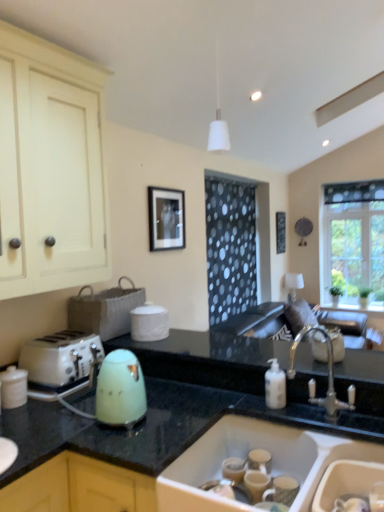
What do you see at coordinates (13, 387) in the screenshot? I see `white glossy jar at lower left` at bounding box center [13, 387].

What do you see at coordinates (60, 358) in the screenshot?
I see `white plastic toaster at left` at bounding box center [60, 358].

Where is `white glossy jar at lower left`? This screenshot has width=384, height=512. white glossy jar at lower left is located at coordinates (13, 387).

Considering the sizes of objects white glossy jar at lower left and white plastic toaster at left in the image provided, who is shorter, white glossy jar at lower left or white plastic toaster at left?

Standing shorter between the two is white glossy jar at lower left.

From the image's perspective, is white glossy jar at lower left above or below white plastic toaster at left?

white glossy jar at lower left is below white plastic toaster at left.

Locate an element on the screen. kitchen appliance on the left of white plastic toaster at left is located at coordinates (13, 387).

Between white glossy jar at lower left and white plastic toaster at left, which one has larger size?

Bigger between the two is white plastic toaster at left.

From their relative heights in the image, would you say matte cream cabinet at left is taller or shorter than white plastic toaster at left?

matte cream cabinet at left is taller than white plastic toaster at left.

Considering the positions of objects matte cream cabinet at left and white plastic toaster at left in the image provided, who is more to the left, matte cream cabinet at left or white plastic toaster at left?

From the viewer's perspective, matte cream cabinet at left appears more on the left side.

Is matte cream cabinet at left far away from white plastic toaster at left?

No.

Based on the photo, relative to white plastic toaster at left, is matte cream cabinet at left in front or behind?

matte cream cabinet at left is positioned closer to the viewer than white plastic toaster at left.

Is white ceramic sink at lower center outside of matte cream cabinet at left?

Absolutely, white ceramic sink at lower center is external to matte cream cabinet at left.

From a real-world perspective, which object rests below the other?

white ceramic sink at lower center.

The width and height of the screenshot is (384, 512). In order to click on sink on the right of matte cream cabinet at left in this screenshot , I will do `click(245, 456)`.

Is black matte picture frame at upper center in contact with white ceramic sink at lower center?

No, black matte picture frame at upper center is not with white ceramic sink at lower center.

From the image's perspective, between black matte picture frame at upper center and white ceramic sink at lower center, which one is located above?

black matte picture frame at upper center, from the image's perspective.

Is black matte picture frame at upper center looking in the opposite direction of white ceramic sink at lower center?

No.

Which is more to the right, black matte picture frame at upper center or white ceramic sink at lower center?

Positioned to the right is white ceramic sink at lower center.

Between matte cream cabinet at left and white glossy jar at lower left, which one has smaller size?

white glossy jar at lower left is smaller.

Which object is thinner, matte cream cabinet at left or white glossy jar at lower left?

white glossy jar at lower left.

Can you confirm if matte cream cabinet at left is taller than white glossy jar at lower left?

Yes.

Which point is more distant from viewer, [84,224] or [3,399]?

The point [84,224] is more distant.

Is matte cream cabinet at left facing towards clear glass window at upper right?

No, matte cream cabinet at left is not turned towards clear glass window at upper right.

What's the angular difference between matte cream cabinet at left and clear glass window at upper right's facing directions?

89.2 degrees.

From the image's perspective, is matte cream cabinet at left above or below clear glass window at upper right?

Based on their image positions, matte cream cabinet at left is located above clear glass window at upper right.

From a real-world perspective, which object rests below the other?

clear glass window at upper right.

Between black matte picture frame at upper center and matte cream cabinet at left, which one has smaller size?

black matte picture frame at upper center.

From a real-world perspective, between black matte picture frame at upper center and matte cream cabinet at left, who is vertically lower?

black matte picture frame at upper center, from a real-world perspective.

Locate an element on the screen. The width and height of the screenshot is (384, 512). toaster behind the white glossy jar at lower left is located at coordinates (60, 358).

The height and width of the screenshot is (512, 384). I want to click on cabinetry above the white plastic toaster at left (from a real-world perspective), so click(x=50, y=167).

Estimate the real-world distances between objects in this image. Which object is closer to green glossy kettle at lower center, black matte picture frame at upper center or white plastic toaster at left?

The object closer to green glossy kettle at lower center is white plastic toaster at left.

In the scene shown: Which object lies further to the anchor point white ceramic sink at lower center, black matte picture frame at upper center or matte cream cabinet at left?

black matte picture frame at upper center lies further to white ceramic sink at lower center than the other object.

Looking at the image, which one is located further to matte cream cabinet at left, white glossy jar at lower left or black matte picture frame at upper center?

black matte picture frame at upper center is further to matte cream cabinet at left.

Estimate the real-world distances between objects in this image. Which object is further from black matte picture frame at upper center, white plastic toaster at left or white glossy jar at lower left?

white glossy jar at lower left lies further to black matte picture frame at upper center than the other object.

Based on their spatial positions, is white plastic toaster at left or green glossy kettle at lower center closer to white glossy jar at lower left?

The object closer to white glossy jar at lower left is white plastic toaster at left.

From the image, which object appears to be nearer to white ceramic sink at lower center, white glossy jar at lower left or white plastic toaster at left?

The object closer to white ceramic sink at lower center is white plastic toaster at left.

Considering their positions, is black matte picture frame at upper center positioned closer to clear glass window at upper right than white ceramic sink at lower center?

black matte picture frame at upper center.

Which object lies further to the anchor point white plastic toaster at left, green glossy kettle at lower center or black matte picture frame at upper center?

black matte picture frame at upper center.

Locate an element on the screen. This screenshot has width=384, height=512. toaster located between white ceramic sink at lower center and black matte picture frame at upper center in the depth direction is located at coordinates (60, 358).

Locate an element on the screen. This screenshot has width=384, height=512. picture frame positioned between white ceramic sink at lower center and clear glass window at upper right from near to far is located at coordinates (166, 218).

Where is `cabinetry located between white ceramic sink at lower center and black matte picture frame at upper center in the depth direction`? The height and width of the screenshot is (512, 384). cabinetry located between white ceramic sink at lower center and black matte picture frame at upper center in the depth direction is located at coordinates (50, 167).

Identify the location of toaster between matte cream cabinet at left and black matte picture frame at upper center from front to back. Image resolution: width=384 pixels, height=512 pixels. point(60,358).